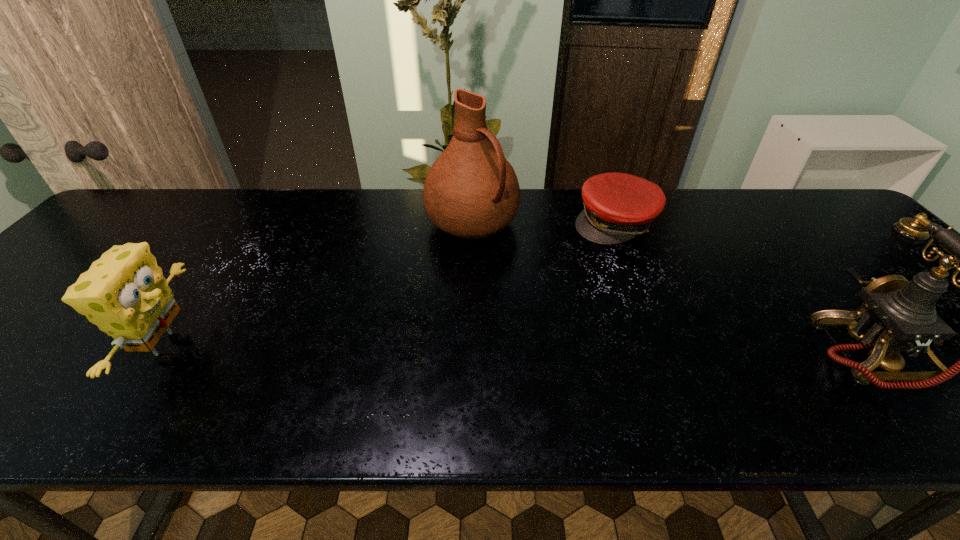
You are a GUI agent. You are given a task and a screenshot of the screen. Output one action in this format:
    pyautogui.click(x=<x>, y=<y>)
    Task: Click on the vacant space on the desktop that is between the sponge and the second tallest object and is positioned on the side of the pitcher with the handle
    
    Given the screenshot: What is the action you would take?
    pyautogui.click(x=607, y=353)

This screenshot has height=540, width=960. Identify the location of vacant spot on the desktop that is between the second shortest object and the rightmost object and is positioned on the front of the cap with an emblem. (502, 352).